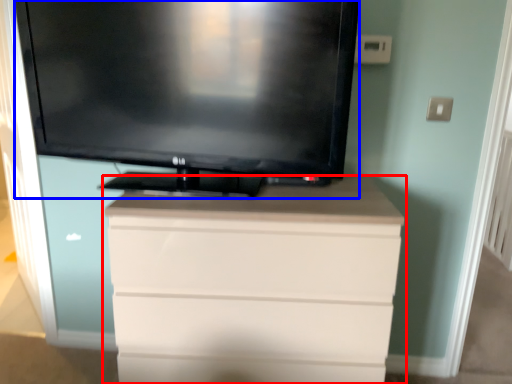
Question: Which object is closer to the camera taking this photo, chest of drawers (highlighted by a red box) or television (highlighted by a blue box)?

Choices:
 (A) chest of drawers
 (B) television

Answer: (B)